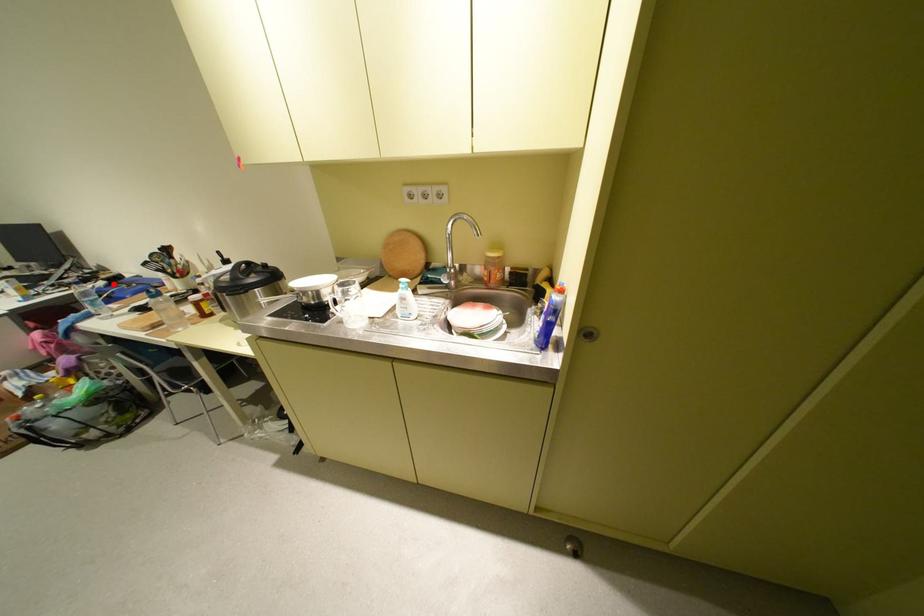
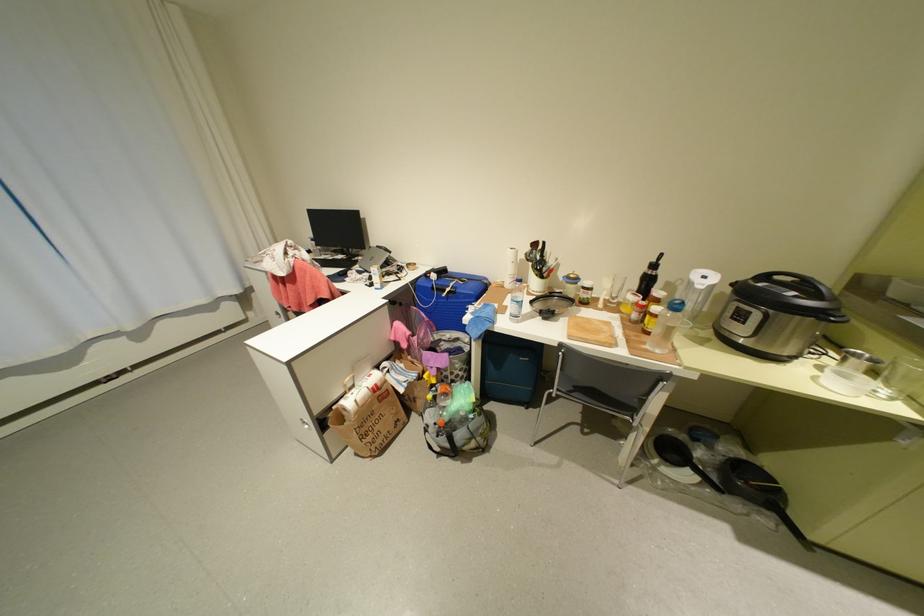
Where in the second image is the point corresponding to the highlighted location from the first image?

(444, 276)